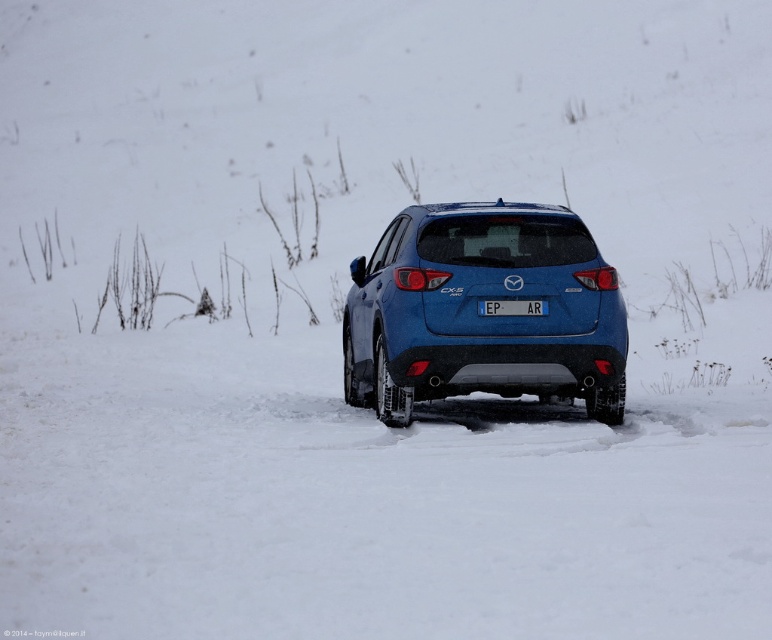
Locate an element on the screen. This screenshot has width=772, height=640. blue matte suv at center is located at coordinates (483, 316).

Find the location of a particular element. The image size is (772, 640). blue matte suv at center is located at coordinates (483, 316).

What are the coordinates of `blue matte suv at center` in the screenshot? It's located at (483, 316).